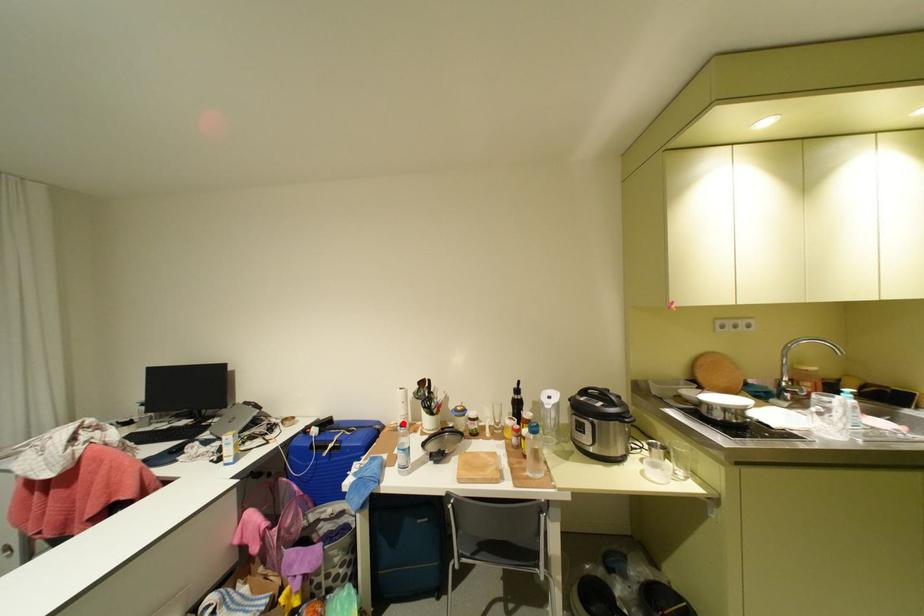
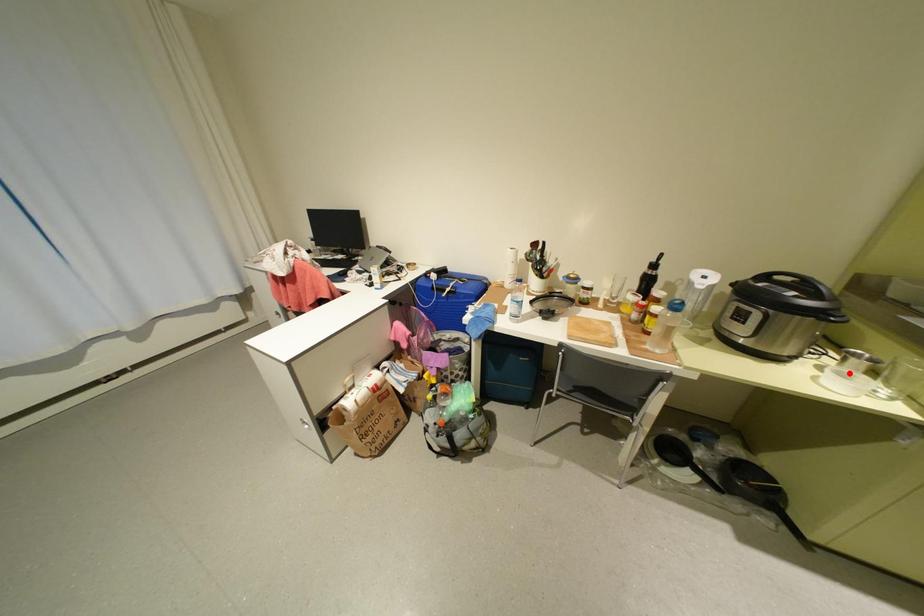
I am providing you with two images of the same scene from different viewpoints. A red point is marked on the first image and another point is marked on the second image. Is the red point in image1 aligned with the point shown in image2?

No